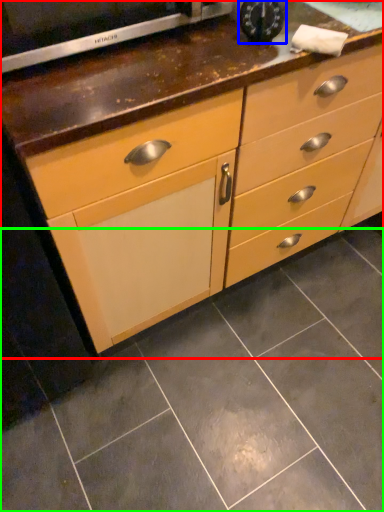
Question: Which object is the closest to the chest of drawers (highlighted by a red box)? Choose among these: appliance (highlighted by a blue box) or ceramic tile (highlighted by a green box).

Choices:
 (A) appliance
 (B) ceramic tile

Answer: (A)